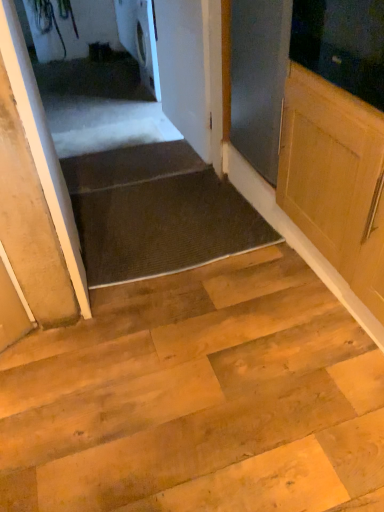
Question: Considering the positions of dark gray textured mat at center and white matte door at upper center, the first door positioned from the back, in the image, is dark gray textured mat at center bigger or smaller than white matte door at upper center, the first door positioned from the back,?

Choices:
 (A) small
 (B) big

Answer: (A)

Question: From a real-world perspective, relative to white matte door at upper center, the 2th door in the left-to-right sequence, is dark gray textured mat at center vertically above or below?

Choices:
 (A) above
 (B) below

Answer: (B)

Question: Considering the real-world distances, which object is closest to the dark gray textured mat at center?

Choices:
 (A) white matte door at left, positioned as the second door in back-to-front order
 (B) dark brown carpet at lower center
 (C) white matte door at upper center, which is the first door in right-to-left order
 (D) white glossy washing machine at upper center

Answer: (B)

Question: Based on their relative distances, which object is farther from the dark gray textured mat at center?

Choices:
 (A) white matte door at upper center, the 2th door in the left-to-right sequence
 (B) white matte door at left, acting as the 1th door starting from the front
 (C) white glossy washing machine at upper center
 (D) dark brown carpet at lower center

Answer: (C)